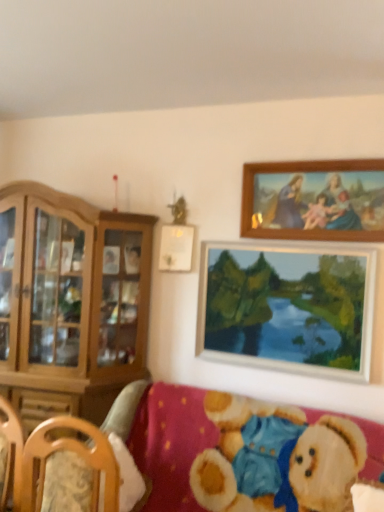
Where is `wooden picture frame at upper right, which is counted as the 3th picture frame, starting from the bottom`? The height and width of the screenshot is (512, 384). wooden picture frame at upper right, which is counted as the 3th picture frame, starting from the bottom is located at coordinates click(314, 200).

The height and width of the screenshot is (512, 384). What do you see at coordinates (70, 302) in the screenshot?
I see `light brown wood cabinet at left` at bounding box center [70, 302].

Find the location of `wooden frame painting at upper right, the 1th picture frame ordered from the bottom`. wooden frame painting at upper right, the 1th picture frame ordered from the bottom is located at coordinates (287, 308).

Where is `velvet teddy bear at lower right`? velvet teddy bear at lower right is located at coordinates (235, 446).

What is the approximate width of wooden picture frame at upper center, the 2th picture frame in the bottom-to-top sequence?

It is 2.39 inches.

Where is `wooden picture frame at upper right, which is counted as the 3th picture frame, starting from the bottom`? wooden picture frame at upper right, which is counted as the 3th picture frame, starting from the bottom is located at coordinates (314, 200).

Considering the relative sizes of light brown wood cabinet at left and wooden picture frame at upper center, which ranks as the 2th picture frame in top-to-bottom order, in the image provided, is light brown wood cabinet at left shorter than wooden picture frame at upper center, which ranks as the 2th picture frame in top-to-bottom order,?

Incorrect, the height of light brown wood cabinet at left does not fall short of that of wooden picture frame at upper center, which ranks as the 2th picture frame in top-to-bottom order.

From a real-world perspective, is light brown wood cabinet at left physically above wooden picture frame at upper center, which ranks as the 2th picture frame in top-to-bottom order?

No, from a real-world perspective, light brown wood cabinet at left is not on top of wooden picture frame at upper center, which ranks as the 2th picture frame in top-to-bottom order.

Is light brown wood cabinet at left completely or partially outside of wooden picture frame at upper center, the 2th picture frame in the bottom-to-top sequence?

Yes, light brown wood cabinet at left is outside of wooden picture frame at upper center, the 2th picture frame in the bottom-to-top sequence.

Does point (51, 279) lie behind point (185, 252)?

No, it is in front of (185, 252).

The image size is (384, 512). I want to click on studio couch that appears on the right of wooden picture frame at upper center, the 2th picture frame in the bottom-to-top sequence, so click(x=235, y=446).

Which is farther, [168,257] or [91,446]?

Point [168,257]

Looking at this image, considering the relative sizes of wooden picture frame at upper center, the 2th picture frame in the bottom-to-top sequence, and velvet teddy bear at lower right in the image provided, is wooden picture frame at upper center, the 2th picture frame in the bottom-to-top sequence, smaller than velvet teddy bear at lower right?

Yes, wooden picture frame at upper center, the 2th picture frame in the bottom-to-top sequence, is smaller than velvet teddy bear at lower right.

Is wooden picture frame at upper right, which is counted as the 3th picture frame, starting from the bottom, oriented towards velvet teddy bear at lower right?

No.

Is wooden picture frame at upper right, which is counted as the 3th picture frame, starting from the bottom, surrounding velvet teddy bear at lower right?

No, velvet teddy bear at lower right is located outside of wooden picture frame at upper right, which is counted as the 3th picture frame, starting from the bottom.

What's the angular difference between wooden picture frame at upper right, the 1th picture frame in the top-to-bottom sequence, and velvet teddy bear at lower right's facing directions?

The angular difference between wooden picture frame at upper right, the 1th picture frame in the top-to-bottom sequence, and velvet teddy bear at lower right is 1.41 degrees.

Is wooden picture frame at upper right, the 1th picture frame in the top-to-bottom sequence, at the right side of velvet teddy bear at lower right?

Yes, wooden picture frame at upper right, the 1th picture frame in the top-to-bottom sequence, is to the right of velvet teddy bear at lower right.

Which of these two, velvet teddy bear at lower right or wooden frame painting at upper right, arranged as the third picture frame when viewed from the top, is bigger?

With larger size is velvet teddy bear at lower right.

Does point (210, 482) come in front of point (260, 267)?

Yes, point (210, 482) is in front of point (260, 267).

Looking at this image, is velvet teddy bear at lower right situated inside wooden frame painting at upper right, the 1th picture frame ordered from the bottom, or outside?

velvet teddy bear at lower right exists outside the volume of wooden frame painting at upper right, the 1th picture frame ordered from the bottom.

Looking at this image, is wooden frame painting at upper right, the 1th picture frame ordered from the bottom, oriented away from wooden picture frame at upper center, which ranks as the 2th picture frame in top-to-bottom order?

No, wooden picture frame at upper center, which ranks as the 2th picture frame in top-to-bottom order, is not at the back of wooden frame painting at upper right, the 1th picture frame ordered from the bottom.

Is point (337, 276) positioned after point (183, 263)?

No, it is not.

Based on the photo, is wooden frame painting at upper right, the 1th picture frame ordered from the bottom, far away from wooden picture frame at upper center, the 2th picture frame in the bottom-to-top sequence?

They are positioned close to each other.

Considering the sizes of wooden frame painting at upper right, arranged as the third picture frame when viewed from the top, and wooden picture frame at upper center, which ranks as the 2th picture frame in top-to-bottom order, in the image, is wooden frame painting at upper right, arranged as the third picture frame when viewed from the top, taller or shorter than wooden picture frame at upper center, which ranks as the 2th picture frame in top-to-bottom order,?

In the image, wooden frame painting at upper right, arranged as the third picture frame when viewed from the top, appears to be taller than wooden picture frame at upper center, which ranks as the 2th picture frame in top-to-bottom order.

Based on the photo, considering the sizes of objects wooden frame painting at upper right, the 1th picture frame ordered from the bottom, and wooden picture frame at upper right, the 1th picture frame in the top-to-bottom sequence, in the image provided, who is shorter, wooden frame painting at upper right, the 1th picture frame ordered from the bottom, or wooden picture frame at upper right, the 1th picture frame in the top-to-bottom sequence,?

wooden picture frame at upper right, the 1th picture frame in the top-to-bottom sequence.

Is wooden frame painting at upper right, the 1th picture frame ordered from the bottom, to the right of wooden picture frame at upper right, which is counted as the 3th picture frame, starting from the bottom, from the viewer's perspective?

In fact, wooden frame painting at upper right, the 1th picture frame ordered from the bottom, is to the left of wooden picture frame at upper right, which is counted as the 3th picture frame, starting from the bottom.

This screenshot has width=384, height=512. I want to click on the 2nd picture frame positioned above the wooden frame painting at upper right, the 1th picture frame ordered from the bottom (from the image's perspective), so click(314, 200).

Can we say wooden frame painting at upper right, the 1th picture frame ordered from the bottom, lies outside wooden picture frame at upper right, which is counted as the 3th picture frame, starting from the bottom?

Yes, wooden frame painting at upper right, the 1th picture frame ordered from the bottom, is not within wooden picture frame at upper right, which is counted as the 3th picture frame, starting from the bottom.

From the image's perspective, relative to wooden frame painting at upper right, the 1th picture frame ordered from the bottom, is wooden picture frame at upper right, which is counted as the 3th picture frame, starting from the bottom, above or below?

Clearly, from the image's perspective, wooden picture frame at upper right, which is counted as the 3th picture frame, starting from the bottom, is above wooden frame painting at upper right, the 1th picture frame ordered from the bottom.

Which object is closer to the camera, wooden picture frame at upper right, which is counted as the 3th picture frame, starting from the bottom, or wooden frame painting at upper right, the 1th picture frame ordered from the bottom?

wooden picture frame at upper right, which is counted as the 3th picture frame, starting from the bottom, is closer to the camera.

Is point (284, 168) more distant than point (340, 298)?

Yes.

Based on the photo, can you confirm if wooden picture frame at upper right, which is counted as the 3th picture frame, starting from the bottom, is shorter than wooden frame painting at upper right, the 1th picture frame ordered from the bottom?

Indeed, wooden picture frame at upper right, which is counted as the 3th picture frame, starting from the bottom, has a lesser height compared to wooden frame painting at upper right, the 1th picture frame ordered from the bottom.

Starting from the light brown wood cabinet at left, which picture frame is the 3rd one behind? Please provide its 2D coordinates.

[(176, 248)]

There is a velvet teddy bear at lower right. Identify the location of the 2nd picture frame above it (from a real-world perspective). (176, 248).

Which object lies further to the anchor point wooden frame painting at upper right, arranged as the third picture frame when viewed from the top, velvet teddy bear at lower right or wooden picture frame at upper center, which ranks as the 2th picture frame in top-to-bottom order?

Based on the image, wooden picture frame at upper center, which ranks as the 2th picture frame in top-to-bottom order, appears to be further to wooden frame painting at upper right, arranged as the third picture frame when viewed from the top.

From the image, which object appears to be farther from velvet teddy bear at lower right, wooden frame painting at upper right, the 1th picture frame ordered from the bottom, or wooden picture frame at upper center, which ranks as the 2th picture frame in top-to-bottom order?

The object further to velvet teddy bear at lower right is wooden picture frame at upper center, which ranks as the 2th picture frame in top-to-bottom order.

Based on their spatial positions, is velvet teddy bear at lower right or wooden picture frame at upper center, the 2th picture frame in the bottom-to-top sequence, further from wooden picture frame at upper right, which is counted as the 3th picture frame, starting from the bottom?

velvet teddy bear at lower right lies further to wooden picture frame at upper right, which is counted as the 3th picture frame, starting from the bottom, than the other object.

From the image, which object appears to be farther from wooden picture frame at upper center, the 2th picture frame in the bottom-to-top sequence, wooden frame painting at upper right, the 1th picture frame ordered from the bottom, or wooden picture frame at upper right, the 1th picture frame in the top-to-bottom sequence?

wooden picture frame at upper right, the 1th picture frame in the top-to-bottom sequence.

From the image, which object appears to be nearer to wooden frame painting at upper right, the 1th picture frame ordered from the bottom, wooden picture frame at upper center, which ranks as the 2th picture frame in top-to-bottom order, or light brown wood cabinet at left?

The object closer to wooden frame painting at upper right, the 1th picture frame ordered from the bottom, is wooden picture frame at upper center, which ranks as the 2th picture frame in top-to-bottom order.

Based on the photo, which object lies nearer to the anchor point wooden picture frame at upper center, the 2th picture frame in the bottom-to-top sequence, wooden frame painting at upper right, arranged as the third picture frame when viewed from the top, or velvet teddy bear at lower right?

Based on the image, wooden frame painting at upper right, arranged as the third picture frame when viewed from the top, appears to be nearer to wooden picture frame at upper center, the 2th picture frame in the bottom-to-top sequence.

Looking at the image, which one is located further to wooden picture frame at upper right, which is counted as the 3th picture frame, starting from the bottom, wooden frame painting at upper right, the 1th picture frame ordered from the bottom, or velvet teddy bear at lower right?

velvet teddy bear at lower right.

Based on their spatial positions, is velvet teddy bear at lower right or wooden picture frame at upper right, which is counted as the 3th picture frame, starting from the bottom, further from light brown wood cabinet at left?

The object further to light brown wood cabinet at left is wooden picture frame at upper right, which is counted as the 3th picture frame, starting from the bottom.

Find the location of a particular element. Image resolution: width=384 pixels, height=512 pixels. studio couch between light brown wood cabinet at left and wooden picture frame at upper right, the 1th picture frame in the top-to-bottom sequence, in the horizontal direction is located at coordinates (235, 446).

Find the location of `picture frame between wooden picture frame at upper center, which ranks as the 2th picture frame in top-to-bottom order, and wooden picture frame at upper right, the 1th picture frame in the top-to-bottom sequence, from left to right`. picture frame between wooden picture frame at upper center, which ranks as the 2th picture frame in top-to-bottom order, and wooden picture frame at upper right, the 1th picture frame in the top-to-bottom sequence, from left to right is located at coordinates (287, 308).

I want to click on cabinetry positioned between velvet teddy bear at lower right and wooden picture frame at upper center, which ranks as the 2th picture frame in top-to-bottom order, from near to far, so click(70, 302).

The height and width of the screenshot is (512, 384). In order to click on studio couch between light brown wood cabinet at left and wooden frame painting at upper right, arranged as the third picture frame when viewed from the top in this screenshot , I will do `click(235, 446)`.